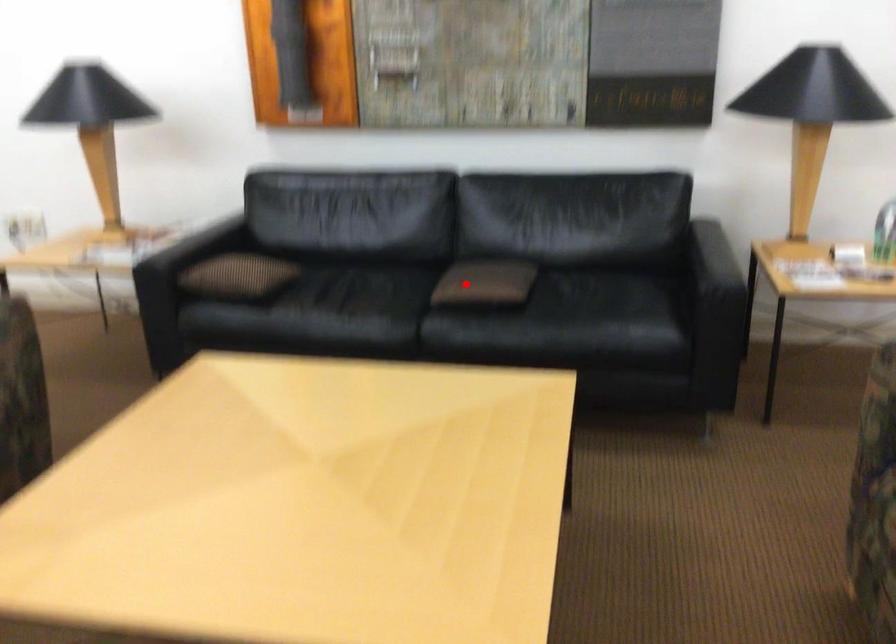
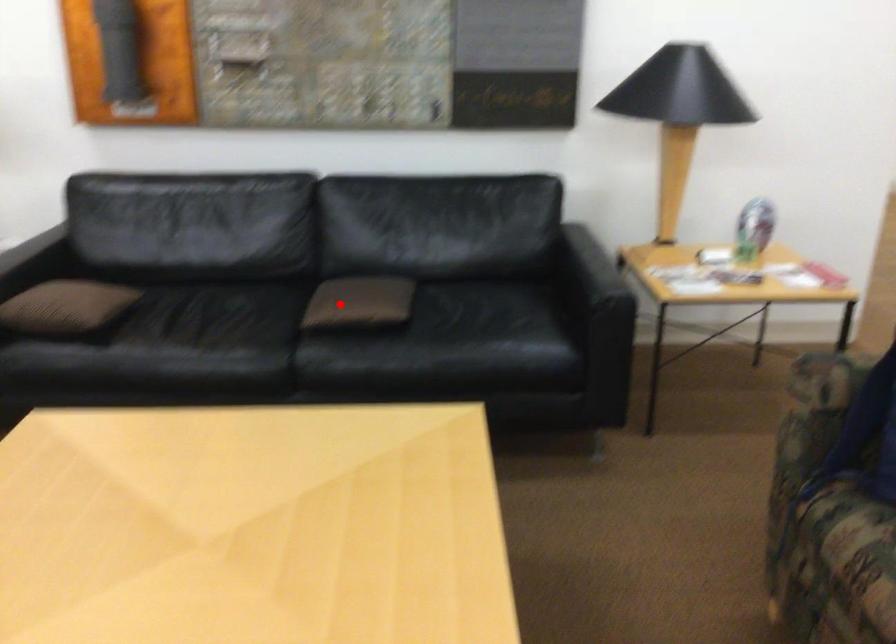
I am providing you with two images of the same scene from different viewpoints. A red point is marked on the first image and another point is marked on the second image. Are the points marked in image1 and image2 representing the same 3D position?

Yes